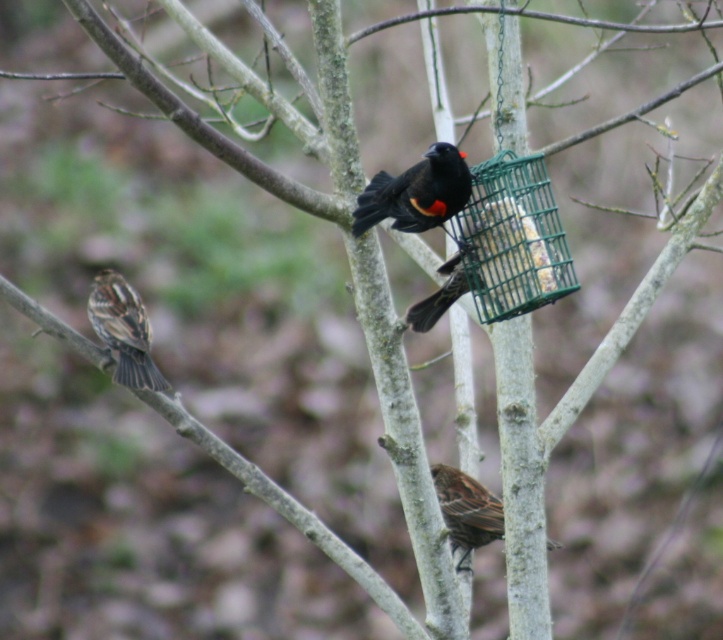
Can you confirm if black glossy sparrow at center is positioned below brown speckled sparrow at lower center?

No, black glossy sparrow at center is not below brown speckled sparrow at lower center.

Who is positioned more to the left, black glossy sparrow at center or brown speckled sparrow at lower center?

black glossy sparrow at center is more to the left.

Consider the image. Who is more forward, (390, 186) or (466, 544)?

Positioned in front is point (390, 186).

Locate an element on the screen. The height and width of the screenshot is (640, 723). black glossy sparrow at center is located at coordinates pos(416,193).

This screenshot has width=723, height=640. Identify the location of green wire mesh bird feeder at upper right. (513, 237).

Who is more distant from viewer, (526, 248) or (463, 540)?

Positioned behind is point (463, 540).

You are a GUI agent. You are given a task and a screenshot of the screen. Output one action in this format:
    pyautogui.click(x=<x>, y=<y>)
    Task: Click on the green wire mesh bird feeder at upper right
    This screenshot has height=640, width=723.
    Given the screenshot: What is the action you would take?
    pyautogui.click(x=513, y=237)

Looking at this image, is brown speckled sparrow at lower center to the left of shiny black bird at center from the viewer's perspective?

In fact, brown speckled sparrow at lower center is to the right of shiny black bird at center.

Is brown speckled sparrow at lower center smaller than shiny black bird at center?

No, brown speckled sparrow at lower center is not smaller than shiny black bird at center.

Who is more forward, (482,518) or (466,252)?

Point (466,252)

You are a GUI agent. You are given a task and a screenshot of the screen. Output one action in this format:
    pyautogui.click(x=<x>, y=<y>)
    Task: Click on the brown speckled sparrow at lower center
    
    Given the screenshot: What is the action you would take?
    pyautogui.click(x=466, y=509)